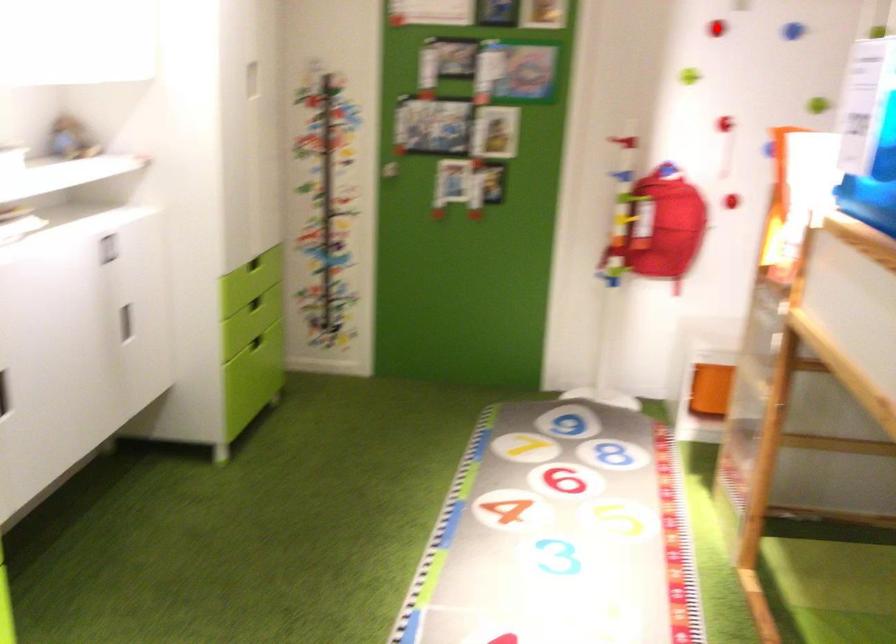
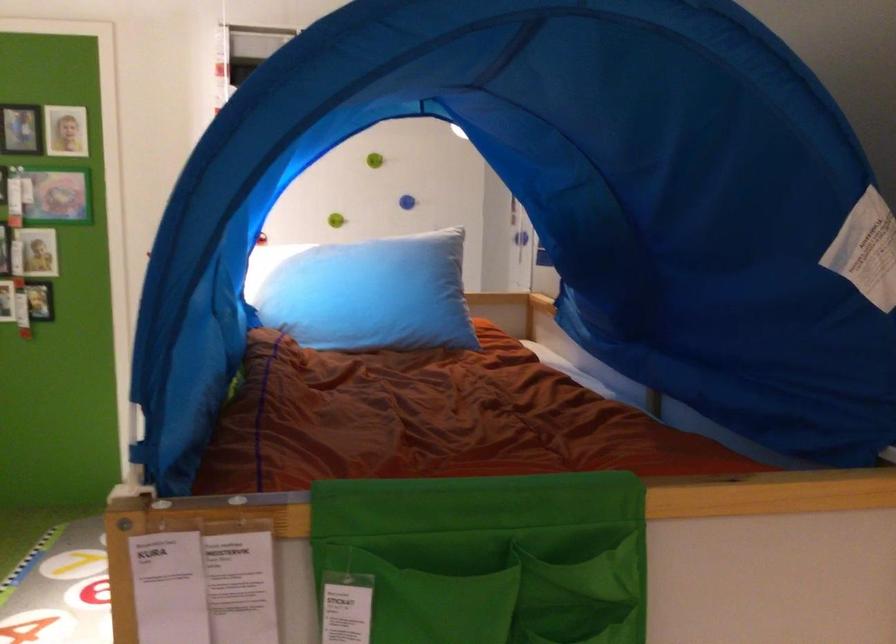
Question: I am providing you with two images of the same scene from different viewpoints. A red point is marked on the first image. At the location where the point appears in image 1, is it still visible in image 2?

Choices:
 (A) Yes
 (B) No

Answer: (B)